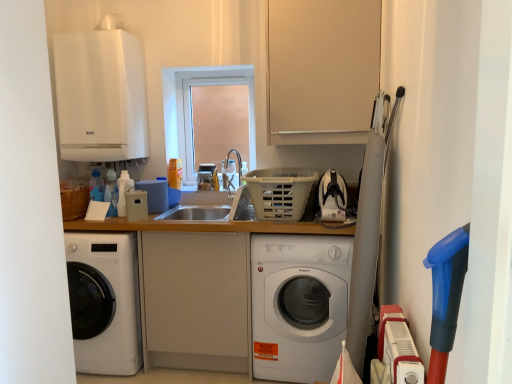
What are the coordinates of `white matte washing machine at center` in the screenshot? It's located at (298, 305).

Locate an element on the screen. This screenshot has width=512, height=384. matte silver faucet at center is located at coordinates (231, 171).

What are the coordinates of `beige plastic speaker at center, which is counted as the first appliance, starting from the bottom` in the screenshot? It's located at (136, 205).

What do you see at coordinates (136, 205) in the screenshot?
I see `beige plastic speaker at center, arranged as the 3th appliance when viewed from the back` at bounding box center [136, 205].

Locate an element on the screen. This screenshot has height=384, width=512. transparent glass window at center is located at coordinates (191, 108).

In order to face transparent glass window at center, should I rotate leftwards or rightwards?

Turn left by 5.220 degrees to look at transparent glass window at center.

What is the approximate height of metallic silver sink at center, the first appliance viewed from the back?

The height of metallic silver sink at center, the first appliance viewed from the back, is 7.42 inches.

Image resolution: width=512 pixels, height=384 pixels. Identify the location of wooden counter at center. (211, 289).

I want to click on white matte washing machine at center, so click(298, 305).

Is beige plastic speaker at center, arranged as the second appliance when viewed from the right, thinner than beige matte cabinet at upper center?

Yes.

From the image's perspective, does beige plastic speaker at center, arranged as the second appliance when viewed from the right, appear higher than beige matte cabinet at upper center?

No.

Is beige matte cabinet at upper center at the back of beige plastic speaker at center, the 3th appliance viewed from the top?

No, beige plastic speaker at center, the 3th appliance viewed from the top,'s orientation is not away from beige matte cabinet at upper center.

Who is smaller, beige plastic speaker at center, arranged as the second appliance when viewed from the right, or beige matte cabinet at upper center?

With smaller size is beige plastic speaker at center, arranged as the second appliance when viewed from the right.

Are white matte washing machine at center and beige matte cabinet at upper center located far from each other?

They are positioned close to each other.

Is beige matte cabinet at upper center located within white matte washing machine at center?

Actually, beige matte cabinet at upper center is outside white matte washing machine at center.

Which is more distant, (277, 266) or (337, 8)?

The point (337, 8) is farther from the camera.

Is white matte washing machine at center looking in the opposite direction of beige matte cabinet at upper center?

white matte washing machine at center is not turned away from beige matte cabinet at upper center.

Is beige matte cabinet at upper center completely or partially inside matte silver faucet at center?

Definitely not — beige matte cabinet at upper center is not inside matte silver faucet at center.

Is matte silver faucet at center in front of or behind beige matte cabinet at upper center in the image?

matte silver faucet at center is positioned farther from the viewer than beige matte cabinet at upper center.

Which is farther, (x=298, y=210) or (x=236, y=80)?

The point (x=236, y=80) is behind.

What's the angular difference between white plastic basket at center and transparent glass window at center's facing directions?

The angular difference between white plastic basket at center and transparent glass window at center is 0.392 degrees.

Which object is positioned more to the right, white plastic basket at center or transparent glass window at center?

white plastic basket at center.

The image size is (512, 384). Identify the location of window above the white plastic basket at center (from the image's perspective). (191, 108).

Looking at the image, does metallic silver sink at center, marked as the second appliance in a bottom-to-top arrangement, seem bigger or smaller compared to white matte washing machine at center?

Clearly, metallic silver sink at center, marked as the second appliance in a bottom-to-top arrangement, is smaller in size than white matte washing machine at center.

What are the coordinates of `washing machine that appears on the right of metallic silver sink at center, the first appliance viewed from the right` in the screenshot? It's located at (298, 305).

Is metallic silver sink at center, which ranks as the 3th appliance in left-to-right order, spatially inside white matte washing machine at center, or outside of it?

metallic silver sink at center, which ranks as the 3th appliance in left-to-right order, is spatially situated outside white matte washing machine at center.

From a real-world perspective, is metallic silver sink at center, the first appliance viewed from the back, over white matte washing machine at center?

Yes, from a real-world perspective, metallic silver sink at center, the first appliance viewed from the back, is over white matte washing machine at center

From the image's perspective, is matte silver faucet at center located above white matte boiler at upper left, the 1th appliance from the left?

Incorrect, from the image's perspective, matte silver faucet at center is lower than white matte boiler at upper left, the 1th appliance from the left.

Measure the distance between matte silver faucet at center and white matte boiler at upper left, the 1th appliance from the left.

matte silver faucet at center and white matte boiler at upper left, the 1th appliance from the left, are 35.63 inches apart.

Are matte silver faucet at center and white matte boiler at upper left, the 2th appliance viewed from the back, located far from each other?

No, matte silver faucet at center is not far from white matte boiler at upper left, the 2th appliance viewed from the back.

From a real-world perspective, which is physically below, matte silver faucet at center or white matte boiler at upper left, the 2th appliance viewed from the back?

matte silver faucet at center, from a real-world perspective.

Can we say beige plastic speaker at center, the 3th appliance viewed from the top, lies outside transparent glass window at center?

Yes, beige plastic speaker at center, the 3th appliance viewed from the top, is not within transparent glass window at center.

Considering the relative positions of beige plastic speaker at center, arranged as the 3th appliance when viewed from the back, and transparent glass window at center in the image provided, is beige plastic speaker at center, arranged as the 3th appliance when viewed from the back, to the left or to the right of transparent glass window at center?

From the image, it's evident that beige plastic speaker at center, arranged as the 3th appliance when viewed from the back, is to the left of transparent glass window at center.

Is beige plastic speaker at center, arranged as the second appliance when viewed from the right, facing towards transparent glass window at center?

No, beige plastic speaker at center, arranged as the second appliance when viewed from the right, does not turn towards transparent glass window at center.

From a real-world perspective, count 3rd appliances downward from the beige matte cabinet at upper center and point to it. Please provide its 2D coordinates.

[(136, 205)]

Where is `cabinetry behind the white matte washing machine at center`? The image size is (512, 384). cabinetry behind the white matte washing machine at center is located at coordinates (322, 70).

From the image, which object appears to be farther from beige matte cabinet at upper center, white matte boiler at upper left, marked as the 1th appliance in a top-to-bottom arrangement, or beige plastic speaker at center, arranged as the 3th appliance when viewed from the back?

The object further to beige matte cabinet at upper center is beige plastic speaker at center, arranged as the 3th appliance when viewed from the back.

When comparing their distances from white matte washing machine at center, does wooden counter at center or transparent glass window at center seem further?

transparent glass window at center is positioned further to the anchor white matte washing machine at center.

Considering their positions, is wooden counter at center positioned further to beige matte cabinet at upper center than white matte washing machine at center?

white matte washing machine at center.

From the image, which object appears to be farther from metallic silver sink at center, which is counted as the 2th appliance, starting from the top, white plastic basket at center or beige matte cabinet at upper center?

beige matte cabinet at upper center is positioned further to the anchor metallic silver sink at center, which is counted as the 2th appliance, starting from the top.

Looking at this image, based on their spatial positions, is white matte boiler at upper left, the second appliance positioned from the front, or transparent glass window at center closer to metallic silver sink at center, the first appliance viewed from the back?

transparent glass window at center.

From the image, which object appears to be farther from beige matte cabinet at upper center, transparent glass window at center or white plastic basket at center?

transparent glass window at center.

From the image, which object appears to be nearer to white matte washing machine at center, beige matte cabinet at upper center or transparent glass window at center?

beige matte cabinet at upper center.

Considering their positions, is wooden counter at center positioned closer to metallic silver sink at center, the first appliance viewed from the back, than beige matte cabinet at upper center?

wooden counter at center is closer to metallic silver sink at center, the first appliance viewed from the back.

In order to click on faucet located between beige matte cabinet at upper center and transparent glass window at center in the depth direction in this screenshot , I will do `click(231, 171)`.

Locate an element on the screen. The image size is (512, 384). faucet positioned between beige plastic speaker at center, arranged as the second appliance when viewed from the right, and transparent glass window at center from near to far is located at coordinates (231, 171).

Image resolution: width=512 pixels, height=384 pixels. I want to click on faucet between transparent glass window at center and white matte washing machine at center from top to bottom, so click(x=231, y=171).

Find the location of a particular element. This screenshot has width=512, height=384. counter top between beige matte cabinet at upper center and white matte washing machine at center in the up-down direction is located at coordinates (211, 289).